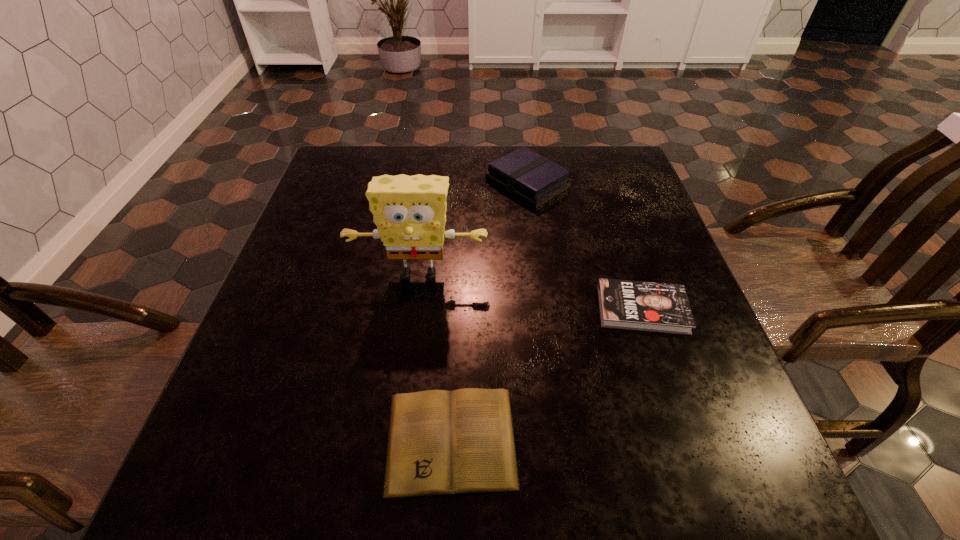
Locate an element on the screen. blank region between the nearest book and the sponge is located at coordinates (435, 357).

At what (x,y) coordinates should I click in order to perform the action: click on object that is the second closest one to the farthest object. Please return your answer as a coordinate pair (x, y). The height and width of the screenshot is (540, 960). Looking at the image, I should click on (633, 305).

Point out which object is positioned as the second nearest to the shortest object. Please provide its 2D coordinates. Your answer should be formatted as a tuple, i.e. [(x, y)], where the tuple contains the x and y coordinates of a point satisfying the conditions above.

[(409, 211)]

The image size is (960, 540). I want to click on book that stands as the third closest to the sponge, so click(x=440, y=442).

Locate which book is the second closest to the third shortest object. Please provide its 2D coordinates. Your answer should be formatted as a tuple, i.e. [(x, y)], where the tuple contains the x and y coordinates of a point satisfying the conditions above.

[(440, 442)]

Identify the location of vacant point that satisfies the following two spatial constraints: 1. on the face of the nearest book; 2. on the right side of the tallest object. This screenshot has width=960, height=540. (396, 440).

Locate an element on the screen. vacant area in the image that satisfies the following two spatial constraints: 1. on the face of the tallest object; 2. on the right side of the shortest book is located at coordinates (396, 440).

Where is `vacant position in the image that satisfies the following two spatial constraints: 1. on the face of the tallest object; 2. on the right side of the second tallest book`? The width and height of the screenshot is (960, 540). vacant position in the image that satisfies the following two spatial constraints: 1. on the face of the tallest object; 2. on the right side of the second tallest book is located at coordinates (414, 309).

This screenshot has width=960, height=540. In order to click on free space that satisfies the following two spatial constraints: 1. on the face of the tallest object; 2. on the right side of the second shortest object in this screenshot , I will do `click(414, 309)`.

Where is `vacant region that satisfies the following two spatial constraints: 1. on the face of the shortest book; 2. on the left side of the sponge`? vacant region that satisfies the following two spatial constraints: 1. on the face of the shortest book; 2. on the left side of the sponge is located at coordinates (396, 440).